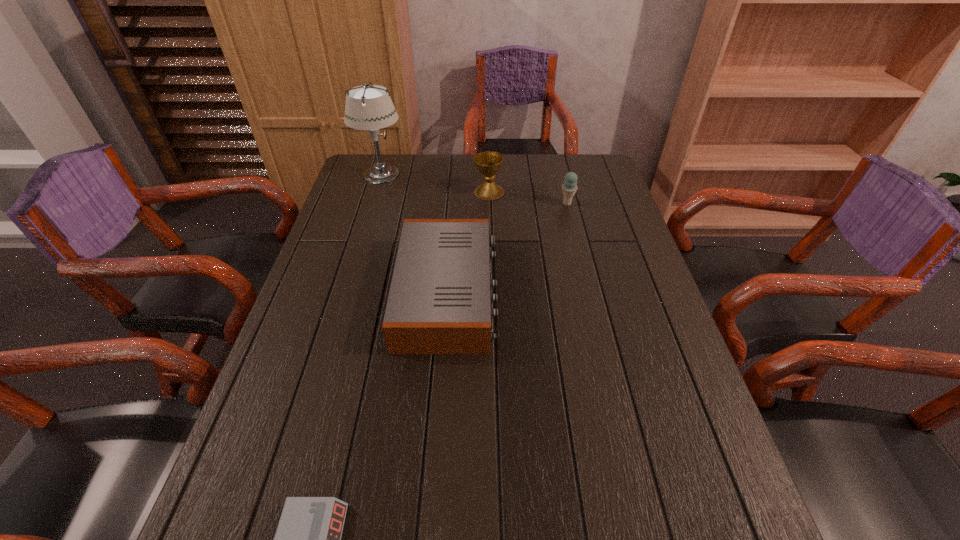
Locate an element on the screen. The width and height of the screenshot is (960, 540). lampshade is located at coordinates (369, 107).

Find the location of a particular element. This screenshot has height=540, width=960. chalice is located at coordinates (488, 164).

What are the coordinates of `ice cream` in the screenshot? It's located at (569, 188).

Locate an element on the screen. Image resolution: width=960 pixels, height=540 pixels. the second shortest object is located at coordinates (439, 302).

I want to click on radio receiver, so click(x=439, y=302).

Locate an element on the screen. This screenshot has width=960, height=540. vacant region located 0.130m on the lampshade of the lampshade is located at coordinates (442, 174).

This screenshot has height=540, width=960. I want to click on free space located on the front of the chalice, so click(491, 254).

Find the location of `free space located 0.060m on the front of the ice cream`. free space located 0.060m on the front of the ice cream is located at coordinates (571, 219).

Find the location of a particular element. free space located on the front panel of the second shortest object is located at coordinates (592, 293).

Identify the location of lampshade situated at the far edge. This screenshot has width=960, height=540. (369, 107).